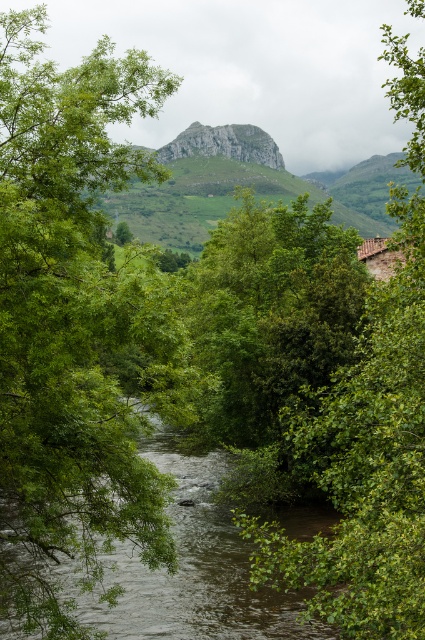
At what (x,y) coordinates should I click in order to perform the action: click on green leafy stream at center. Please return your answer as a coordinate pair (x, y). This screenshot has height=640, width=425. Looking at the image, I should click on (184, 570).

Image resolution: width=425 pixels, height=640 pixels. What do you see at coordinates (184, 570) in the screenshot?
I see `green leafy stream at center` at bounding box center [184, 570].

Is point (204, 508) positioned behind point (248, 154)?

No.

What are the coordinates of `green leafy stream at center` in the screenshot? It's located at point(184,570).

This screenshot has height=640, width=425. What do you see at coordinates (73, 323) in the screenshot?
I see `green leafy tree at left` at bounding box center [73, 323].

Does green leafy tree at left lie in front of rugged stone mountain at center?

Yes, green leafy tree at left is in front of rugged stone mountain at center.

What are the coordinates of `green leafy tree at left` in the screenshot? It's located at (73, 323).

Who is higher up, green leafy tree at left or green leafy tree at center?

green leafy tree at center

Is point (127, 428) closer to viewer compared to point (331, 588)?

No, (127, 428) is behind (331, 588).

The image size is (425, 640). What do you see at coordinates (73, 323) in the screenshot? I see `green leafy tree at left` at bounding box center [73, 323].

Image resolution: width=425 pixels, height=640 pixels. Identify the location of green leafy tree at left. (73, 323).